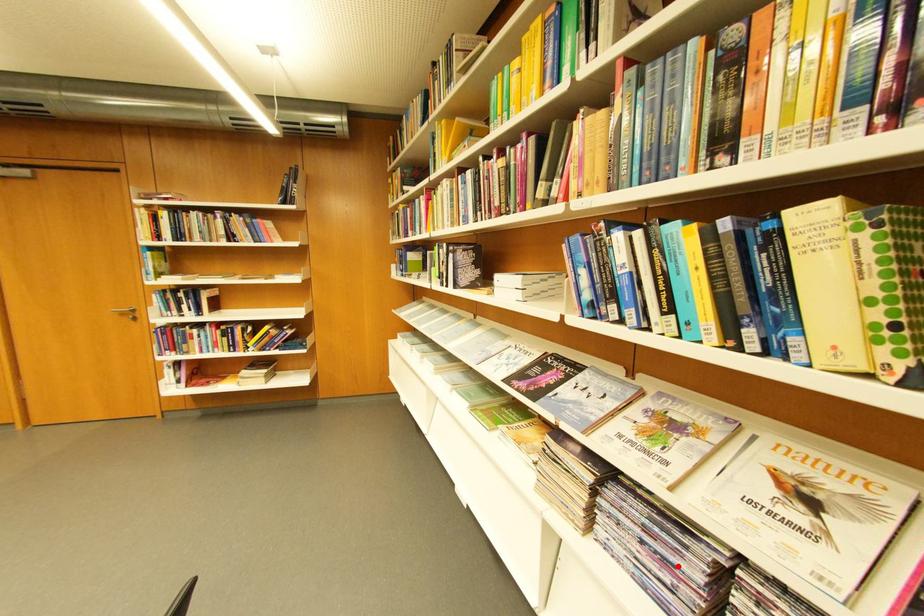
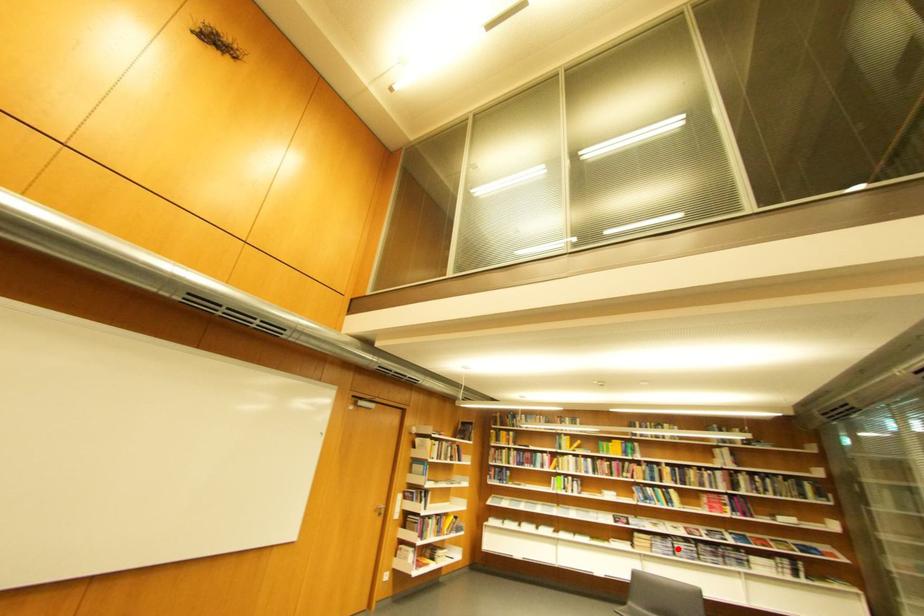
I am providing you with two images of the same scene from different viewpoints. A red point is marked on the first image and another point is marked on the second image. Does the point marked in image1 correspond to the same location as the one in image2?

Yes